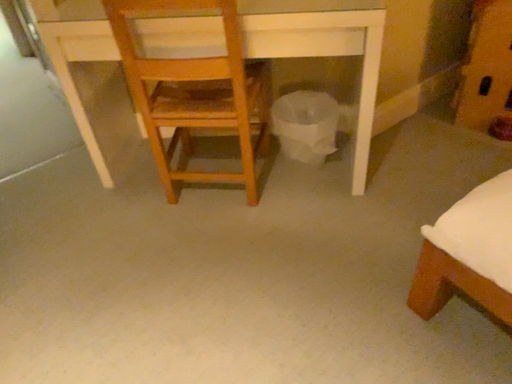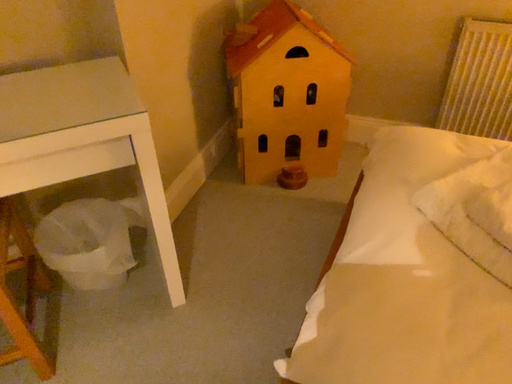
Question: Which way did the camera rotate in the video?

Choices:
 (A) rotated upward
 (B) rotated downward

Answer: (A)